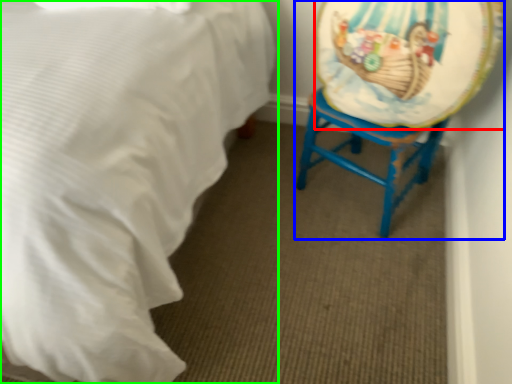
Question: Which object is positioned closest to platter (highlighted by a red box)? Select from swivel chair (highlighted by a blue box) and bed (highlighted by a green box).

Choices:
 (A) swivel chair
 (B) bed

Answer: (A)